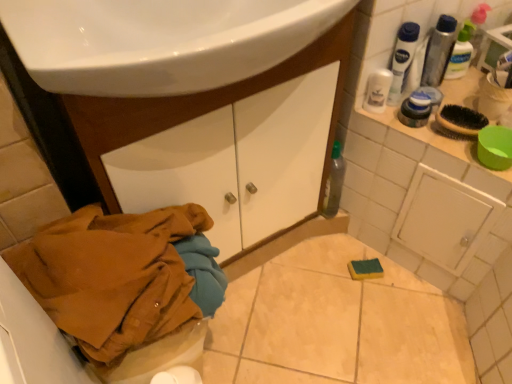
Question: Does translucent plastic mouthwash at upper right, the third mouthwash positioned from the left, turn towards brown cotton jacket at lower left?

Choices:
 (A) yes
 (B) no

Answer: (B)

Question: Can you confirm if translucent plastic mouthwash at upper right, positioned as the 2th mouthwash in right-to-left order, is thinner than brown cotton jacket at lower left?

Choices:
 (A) no
 (B) yes

Answer: (B)

Question: Is translucent plastic mouthwash at upper right, the third mouthwash positioned from the left, placed right next to brown cotton jacket at lower left?

Choices:
 (A) yes
 (B) no

Answer: (B)

Question: Is the depth of translucent plastic mouthwash at upper right, positioned as the 2th mouthwash in right-to-left order, greater than that of brown cotton jacket at lower left?

Choices:
 (A) yes
 (B) no

Answer: (A)

Question: Is translucent plastic mouthwash at upper right, the third mouthwash positioned from the left, not close to brown cotton jacket at lower left?

Choices:
 (A) yes
 (B) no

Answer: (B)

Question: Is point (378, 87) closer or farther from the camera than point (196, 206)?

Choices:
 (A) closer
 (B) farther

Answer: (B)

Question: Would you say white plastic mouthwash at upper right, marked as the first mouthwash in a left-to-right arrangement, is to the left or to the right of brown cotton jacket at lower left in the picture?

Choices:
 (A) right
 (B) left

Answer: (A)

Question: Is white plastic mouthwash at upper right, marked as the first mouthwash in a left-to-right arrangement, spatially inside brown cotton jacket at lower left, or outside of it?

Choices:
 (A) inside
 (B) outside

Answer: (B)

Question: From a real-world perspective, relative to brown cotton jacket at lower left, is white plastic mouthwash at upper right, acting as the 4th mouthwash starting from the right, vertically above or below?

Choices:
 (A) above
 (B) below

Answer: (A)

Question: Is white plastic mouthwash at upper right, which is the 2th mouthwash from left to right, wider or thinner than white plastic mouthwash at upper right, marked as the first mouthwash in a left-to-right arrangement?

Choices:
 (A) wide
 (B) thin

Answer: (B)

Question: From the image's perspective, is white plastic mouthwash at upper right, acting as the 3th mouthwash starting from the right, above or below white plastic mouthwash at upper right, acting as the 4th mouthwash starting from the right?

Choices:
 (A) below
 (B) above

Answer: (B)

Question: From a real-world perspective, is white plastic mouthwash at upper right, which is the 2th mouthwash from left to right, positioned above or below white plastic mouthwash at upper right, acting as the 4th mouthwash starting from the right?

Choices:
 (A) below
 (B) above

Answer: (B)

Question: Relative to white plastic mouthwash at upper right, marked as the first mouthwash in a left-to-right arrangement, is white plastic mouthwash at upper right, which is the 2th mouthwash from left to right, in front or behind?

Choices:
 (A) behind
 (B) front

Answer: (B)

Question: Considering the positions of point (439, 26) and point (468, 26), is point (439, 26) closer or farther from the camera than point (468, 26)?

Choices:
 (A) closer
 (B) farther

Answer: (A)

Question: From a real-world perspective, is translucent plastic mouthwash at upper right, the third mouthwash positioned from the left, positioned above or below translucent plastic mouthwash at upper right, placed as the first mouthwash when sorted from right to left?

Choices:
 (A) above
 (B) below

Answer: (A)